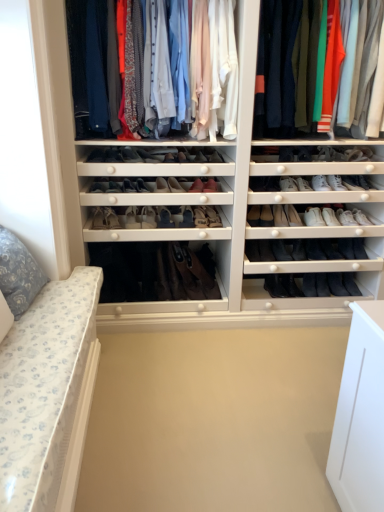
Question: Should I look upward or downward to see leather shoes at center, positioned as the 3th shoe in left-to-right order?

Choices:
 (A) down
 (B) up

Answer: (B)

Question: Which direction should I rotate to look at matte black shoe at center, the tenth shoe positioned from the left, — up or down?

Choices:
 (A) up
 (B) down

Answer: (A)

Question: Can you confirm if leather boot at center, positioned as the 5th shoe in right-to-left order, is shorter than matte black boot at center, arranged as the 10th shoe when viewed from the right?

Choices:
 (A) yes
 (B) no

Answer: (A)

Question: Is leather boot at center, positioned as the 5th shoe in right-to-left order, thinner than matte black boot at center, acting as the fifteenth shoe starting from the left?

Choices:
 (A) no
 (B) yes

Answer: (B)

Question: Could matte black boot at center, arranged as the 10th shoe when viewed from the right, be considered to be inside leather boot at center, positioned as the 5th shoe in right-to-left order?

Choices:
 (A) yes
 (B) no

Answer: (B)

Question: Is the position of leather boot at center, positioned as the 5th shoe in right-to-left order, more distant than that of matte black boot at center, arranged as the 10th shoe when viewed from the right?

Choices:
 (A) no
 (B) yes

Answer: (A)

Question: Considering the relative positions of leather boot at center, positioned as the 5th shoe in right-to-left order, and matte black boot at center, acting as the fifteenth shoe starting from the left, in the image provided, is leather boot at center, positioned as the 5th shoe in right-to-left order, to the left of matte black boot at center, acting as the fifteenth shoe starting from the left, from the viewer's perspective?

Choices:
 (A) yes
 (B) no

Answer: (B)

Question: From the image's perspective, is leather boot at center, the twentieth shoe positioned from the left, located above matte black boot at center, arranged as the 10th shoe when viewed from the right?

Choices:
 (A) no
 (B) yes

Answer: (B)

Question: Is matte cotton t-shirts at upper right, placed as the 2th clothing when sorted from left to right, positioned beyond the bounds of leather boot at center, the fourteenth shoe when ordered from left to right?

Choices:
 (A) yes
 (B) no

Answer: (A)

Question: Considering the relative sizes of matte cotton t-shirts at upper right, placed as the 2th clothing when sorted from left to right, and leather boot at center, which ranks as the eleventh shoe in right-to-left order, in the image provided, is matte cotton t-shirts at upper right, placed as the 2th clothing when sorted from left to right, shorter than leather boot at center, which ranks as the eleventh shoe in right-to-left order,?

Choices:
 (A) no
 (B) yes

Answer: (A)

Question: Can you confirm if matte cotton t-shirts at upper right, positioned as the 1th clothing in right-to-left order, is taller than leather boot at center, which ranks as the eleventh shoe in right-to-left order?

Choices:
 (A) yes
 (B) no

Answer: (A)

Question: Is matte cotton t-shirts at upper right, positioned as the 1th clothing in right-to-left order, in contact with leather boot at center, which ranks as the eleventh shoe in right-to-left order?

Choices:
 (A) no
 (B) yes

Answer: (A)

Question: From a real-world perspective, is matte cotton t-shirts at upper right, placed as the 2th clothing when sorted from left to right, beneath leather boot at center, the fourteenth shoe when ordered from left to right?

Choices:
 (A) yes
 (B) no

Answer: (B)

Question: Would you consider matte cotton t-shirts at upper right, placed as the 2th clothing when sorted from left to right, to be distant from leather boot at center, which ranks as the eleventh shoe in right-to-left order?

Choices:
 (A) no
 (B) yes

Answer: (A)

Question: Is brown suede boot at center in front of floral fabric pillow at left?

Choices:
 (A) yes
 (B) no

Answer: (B)